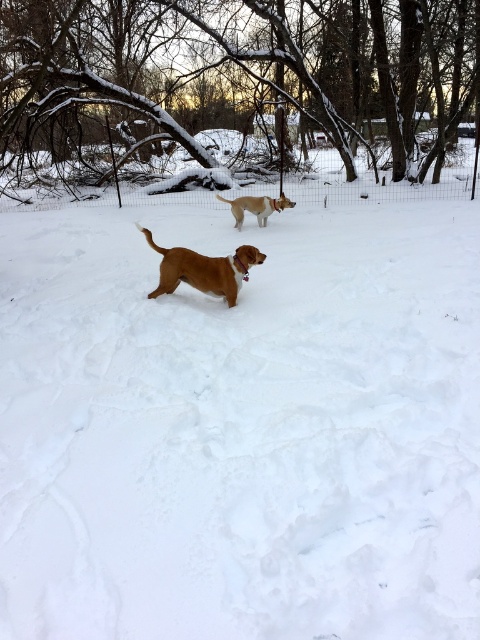
You are a photographer trying to capture both the brown matte dog at center and the brown fur dog at center in a single frame. Which dog should you focus on first to ensure the taller one is in focus?

The brown matte dog at center is taller than the brown fur dog at center, so you should focus on the brown matte dog at center first to ensure the taller one is in focus.

You are a photographer trying to capture both the brown matte dog at center and the brown fur dog at center in a single frame. Given that your camera has a maximum width of 1.2 meters, will you be able to fit both dogs side by side without cropping?

The brown matte dog at center is larger in width than the brown fur dog at center. However, without knowing the exact combined width of both dogs, it is impossible to determine if they can fit within the camera frame. Additional information about their individual widths is required to answer this question.

You are standing at the origin point of the image. A brown matte dog at center is located at point (x=204, y=269). If you walk straight towards the brown matte dog at center, will you reach it before reaching the edge of the image?

Yes, because the point (x=204, y=269) is within the image boundaries, so walking straight towards the brown matte dog at center will reach it before the edge.